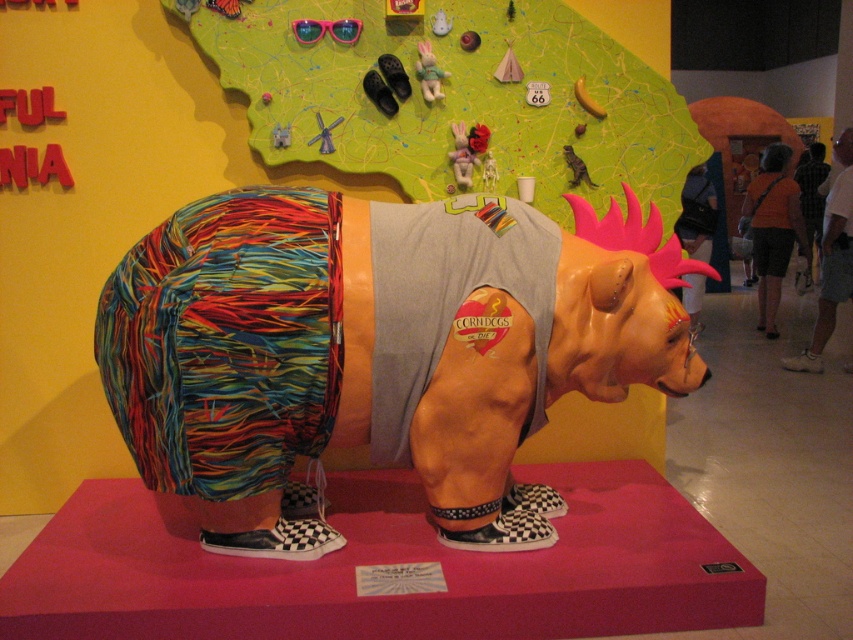
Question: Which of the following is the closest to the observer?

Choices:
 (A) orange fabric shorts at right
 (B) gray shorts at center
 (C) textured fabric bear at center

Answer: (C)

Question: Is textured fabric bear at center above gray shorts at center?

Choices:
 (A) no
 (B) yes

Answer: (A)

Question: Is gray shorts at center bigger than checkered shirt at center?

Choices:
 (A) yes
 (B) no

Answer: (A)

Question: Is textured fabric bear at center in front of checkered shirt at center?

Choices:
 (A) yes
 (B) no

Answer: (A)

Question: Which of the following is the farthest from the observer?

Choices:
 (A) textured fabric bear at center
 (B) checkered shirt at center
 (C) gray shorts at center
 (D) orange fabric shorts at right

Answer: (B)

Question: Based on their relative distances, which object is farther from the gray shorts at center?

Choices:
 (A) orange fabric shorts at right
 (B) textured fabric bear at center
 (C) checkered shirt at center

Answer: (B)